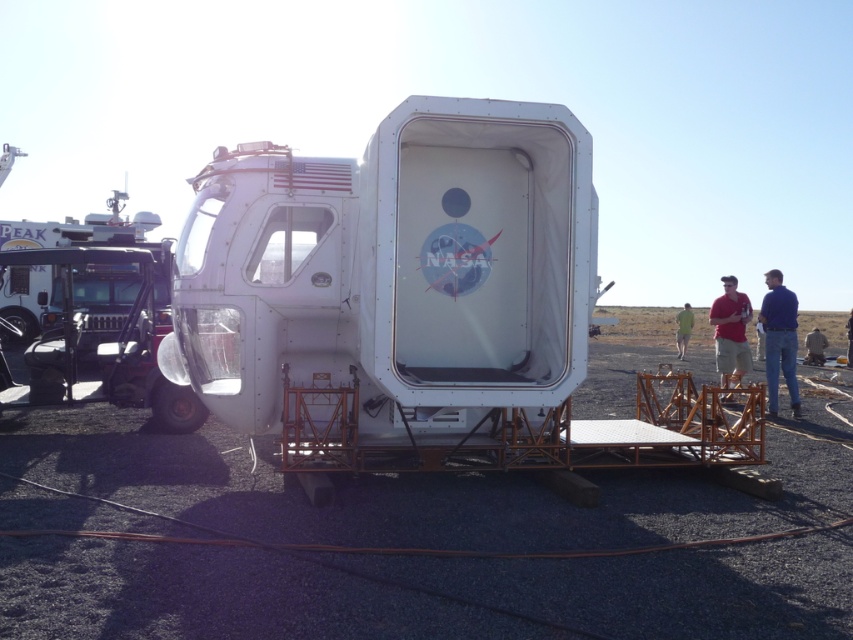
Question: Considering the real-world distances, which object is farthest from the matte red shirt at center?

Choices:
 (A) green fabric shirt at center
 (B) brown leather jacket at lower right

Answer: (A)

Question: Is matte red shirt at center above brown leather jacket at lower right?

Choices:
 (A) no
 (B) yes

Answer: (B)

Question: Does matte red shirt at center appear on the right side of brown leather jacket at lower right?

Choices:
 (A) no
 (B) yes

Answer: (A)

Question: Which point is closer to the camera?

Choices:
 (A) blue jeans at right
 (B) matte red shirt at center
 (C) green fabric shirt at center
 (D) brown leather jacket at lower right

Answer: (A)

Question: Is matte red shirt at center bigger than brown leather jacket at lower right?

Choices:
 (A) no
 (B) yes

Answer: (A)

Question: Which object is positioned farthest from the matte red shirt at center?

Choices:
 (A) green fabric shirt at center
 (B) blue jeans at right
 (C) brown leather jacket at lower right

Answer: (A)